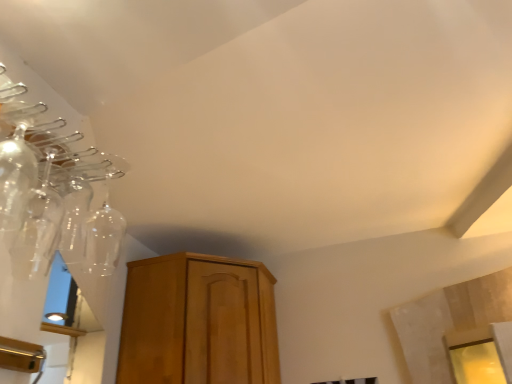
Describe the element at coordinates (15, 178) in the screenshot. I see `transparent glass bottle at left, acting as the 1th glass bottle starting from the front` at that location.

Where is `transparent glass bottle at left, acting as the 1th glass bottle starting from the front`? The width and height of the screenshot is (512, 384). transparent glass bottle at left, acting as the 1th glass bottle starting from the front is located at coordinates (15, 178).

What is the approximate height of transparent glass bottle at left, acting as the 1th glass bottle starting from the front?

It is 10.36 inches.

You are a GUI agent. You are given a task and a screenshot of the screen. Output one action in this format:
    pyautogui.click(x=<x>, y=<y>)
    Task: Click on the transparent glass bottle at upper left, the 1th glass bottle when ordered from back to front
    
    Given the screenshot: What is the action you would take?
    pyautogui.click(x=38, y=229)

What do you see at coordinates (38, 229) in the screenshot? The height and width of the screenshot is (384, 512). I see `transparent glass bottle at upper left, the 1th glass bottle when ordered from back to front` at bounding box center [38, 229].

Where is `transparent glass bottle at left, marked as the second glass bottle in a back-to-front arrangement`? transparent glass bottle at left, marked as the second glass bottle in a back-to-front arrangement is located at coordinates (15, 178).

Which object is positioned more to the right, transparent glass bottle at upper left, which is the 2th glass bottle in front-to-back order, or transparent glass bottle at left, acting as the 1th glass bottle starting from the front?

From the viewer's perspective, transparent glass bottle at upper left, which is the 2th glass bottle in front-to-back order, appears more on the right side.

Between transparent glass bottle at upper left, which is the 2th glass bottle in front-to-back order, and transparent glass bottle at left, marked as the second glass bottle in a back-to-front arrangement, which one is positioned in front?

transparent glass bottle at left, marked as the second glass bottle in a back-to-front arrangement.

Is point (56, 196) positioned after point (22, 140)?

That is True.

From the image's perspective, is transparent glass bottle at upper left, the 1th glass bottle when ordered from back to front, positioned above or below transparent glass bottle at left, acting as the 1th glass bottle starting from the front?

transparent glass bottle at upper left, the 1th glass bottle when ordered from back to front, is below transparent glass bottle at left, acting as the 1th glass bottle starting from the front.

From a real-world perspective, between transparent glass bottle at upper left, which is the 2th glass bottle in front-to-back order, and transparent glass bottle at left, acting as the 1th glass bottle starting from the front, who is vertically higher?

transparent glass bottle at upper left, which is the 2th glass bottle in front-to-back order.

In the scene shown: Considering the sizes of objects transparent glass bottle at upper left, which is the 2th glass bottle in front-to-back order, and transparent glass bottle at left, acting as the 1th glass bottle starting from the front, in the image provided, who is thinner, transparent glass bottle at upper left, which is the 2th glass bottle in front-to-back order, or transparent glass bottle at left, acting as the 1th glass bottle starting from the front,?

transparent glass bottle at left, acting as the 1th glass bottle starting from the front, is thinner.

In the scene shown: Considering the sizes of objects transparent glass bottle at upper left, the 1th glass bottle when ordered from back to front, and transparent glass bottle at left, marked as the second glass bottle in a back-to-front arrangement, in the image provided, who is taller, transparent glass bottle at upper left, the 1th glass bottle when ordered from back to front, or transparent glass bottle at left, marked as the second glass bottle in a back-to-front arrangement,?

With more height is transparent glass bottle at upper left, the 1th glass bottle when ordered from back to front.

Between transparent glass bottle at upper left, which is the 2th glass bottle in front-to-back order, and transparent glass bottle at left, marked as the second glass bottle in a back-to-front arrangement, which one has smaller size?

Smaller between the two is transparent glass bottle at left, marked as the second glass bottle in a back-to-front arrangement.

Does transparent glass bottle at upper left, the 1th glass bottle when ordered from back to front, contain transparent glass bottle at left, acting as the 1th glass bottle starting from the front?

That's incorrect, transparent glass bottle at left, acting as the 1th glass bottle starting from the front, is not inside transparent glass bottle at upper left, the 1th glass bottle when ordered from back to front.

Is transparent glass bottle at upper left, the 1th glass bottle when ordered from back to front, beside transparent glass bottle at left, acting as the 1th glass bottle starting from the front?

Yes, transparent glass bottle at upper left, the 1th glass bottle when ordered from back to front, is beside transparent glass bottle at left, acting as the 1th glass bottle starting from the front.

Is transparent glass bottle at upper left, the 1th glass bottle when ordered from back to front, aimed at transparent glass bottle at left, marked as the second glass bottle in a back-to-front arrangement?

No.

Can you tell me how much transparent glass bottle at upper left, the 1th glass bottle when ordered from back to front, and transparent glass bottle at left, acting as the 1th glass bottle starting from the front, differ in facing direction?

0.00149 degrees.

The width and height of the screenshot is (512, 384). In order to click on glass bottle above the transparent glass bottle at upper left, the 1th glass bottle when ordered from back to front (from the image's perspective) in this screenshot , I will do `click(15, 178)`.

From the picture: Which is more to the right, transparent glass bottle at left, marked as the second glass bottle in a back-to-front arrangement, or transparent glass bottle at upper left, which is the 2th glass bottle in front-to-back order?

transparent glass bottle at upper left, which is the 2th glass bottle in front-to-back order, is more to the right.

Is transparent glass bottle at left, marked as the second glass bottle in a back-to-front arrangement, behind transparent glass bottle at upper left, the 1th glass bottle when ordered from back to front?

No, transparent glass bottle at left, marked as the second glass bottle in a back-to-front arrangement, is in front of transparent glass bottle at upper left, the 1th glass bottle when ordered from back to front.

Which is behind, point (13, 159) or point (23, 265)?

The point (23, 265) is farther.

Looking at this image, from the image's perspective, is transparent glass bottle at left, marked as the second glass bottle in a back-to-front arrangement, under transparent glass bottle at upper left, the 1th glass bottle when ordered from back to front?

Incorrect, from the image's perspective, transparent glass bottle at left, marked as the second glass bottle in a back-to-front arrangement, is higher than transparent glass bottle at upper left, the 1th glass bottle when ordered from back to front.

From a real-world perspective, is transparent glass bottle at left, acting as the 1th glass bottle starting from the front, beneath transparent glass bottle at upper left, which is the 2th glass bottle in front-to-back order?

Indeed, from a real-world perspective, transparent glass bottle at left, acting as the 1th glass bottle starting from the front, is positioned beneath transparent glass bottle at upper left, which is the 2th glass bottle in front-to-back order.

Which object is thinner, transparent glass bottle at left, marked as the second glass bottle in a back-to-front arrangement, or transparent glass bottle at upper left, which is the 2th glass bottle in front-to-back order?

Thinner between the two is transparent glass bottle at left, marked as the second glass bottle in a back-to-front arrangement.

In terms of height, does transparent glass bottle at left, marked as the second glass bottle in a back-to-front arrangement, look taller or shorter compared to transparent glass bottle at upper left, the 1th glass bottle when ordered from back to front?

Clearly, transparent glass bottle at left, marked as the second glass bottle in a back-to-front arrangement, is shorter compared to transparent glass bottle at upper left, the 1th glass bottle when ordered from back to front.

Can you confirm if transparent glass bottle at left, acting as the 1th glass bottle starting from the front, is smaller than transparent glass bottle at upper left, which is the 2th glass bottle in front-to-back order?

Yes.

Choose the correct answer: Is transparent glass bottle at left, acting as the 1th glass bottle starting from the front, inside transparent glass bottle at upper left, which is the 2th glass bottle in front-to-back order, or outside it?

transparent glass bottle at left, acting as the 1th glass bottle starting from the front, is not inside transparent glass bottle at upper left, which is the 2th glass bottle in front-to-back order, it's outside.

Are transparent glass bottle at left, acting as the 1th glass bottle starting from the front, and transparent glass bottle at upper left, the 1th glass bottle when ordered from back to front, making contact?

Yes, the surface of transparent glass bottle at left, acting as the 1th glass bottle starting from the front, is in contact with transparent glass bottle at upper left, the 1th glass bottle when ordered from back to front.

Is transparent glass bottle at left, acting as the 1th glass bottle starting from the front, aimed at transparent glass bottle at upper left, which is the 2th glass bottle in front-to-back order?

No, transparent glass bottle at left, acting as the 1th glass bottle starting from the front, does not turn towards transparent glass bottle at upper left, which is the 2th glass bottle in front-to-back order.

How many degrees apart are the facing directions of transparent glass bottle at left, acting as the 1th glass bottle starting from the front, and transparent glass bottle at upper left, the 1th glass bottle when ordered from back to front?

There is a 0.00149-degree angle between the facing directions of transparent glass bottle at left, acting as the 1th glass bottle starting from the front, and transparent glass bottle at upper left, the 1th glass bottle when ordered from back to front.

How far apart are transparent glass bottle at left, acting as the 1th glass bottle starting from the front, and transparent glass bottle at upper left, the 1th glass bottle when ordered from back to front?

transparent glass bottle at left, acting as the 1th glass bottle starting from the front, is 3.15 inches from transparent glass bottle at upper left, the 1th glass bottle when ordered from back to front.

Find the location of a particular element. glass bottle located on the right of transparent glass bottle at left, acting as the 1th glass bottle starting from the front is located at coordinates [38, 229].

At what (x,y) coordinates should I click in order to perform the action: click on glass bottle directly beneath the transparent glass bottle at upper left, the 1th glass bottle when ordered from back to front (from a real-world perspective). Please return your answer as a coordinate pair (x, y). Looking at the image, I should click on (15, 178).

This screenshot has height=384, width=512. In order to click on glass bottle to the left of transparent glass bottle at upper left, the 1th glass bottle when ordered from back to front in this screenshot , I will do `click(15, 178)`.